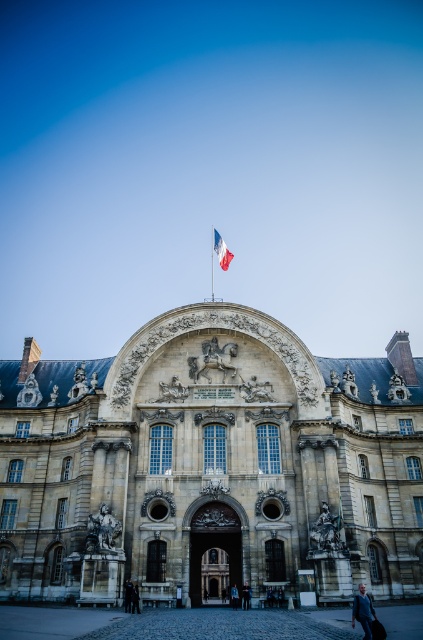
Question: Which point is closer to the camera taking this photo?

Choices:
 (A) (247, 589)
 (B) (131, 584)
 (C) (211, 280)

Answer: (B)

Question: Observing the image, what is the correct spatial positioning of dark blue jeans at center in reference to blue denim jacket at lower center?

Choices:
 (A) left
 (B) right

Answer: (B)

Question: Which of these objects is positioned farthest from the stone textured palace at center?

Choices:
 (A) metallic flag pole at center
 (B) dark gray suit at center
 (C) dark blue jeans at center

Answer: (A)

Question: Which of these objects is positioned farthest from the stone textured palace at center?

Choices:
 (A) dark blue jeans at center
 (B) metallic flag pole at center

Answer: (B)

Question: Is blue jeans at lower right thinner than blue fabric flag at center?

Choices:
 (A) no
 (B) yes

Answer: (A)

Question: Can you confirm if dark gray suit at center is positioned to the right of metallic flag pole at center?

Choices:
 (A) no
 (B) yes

Answer: (A)